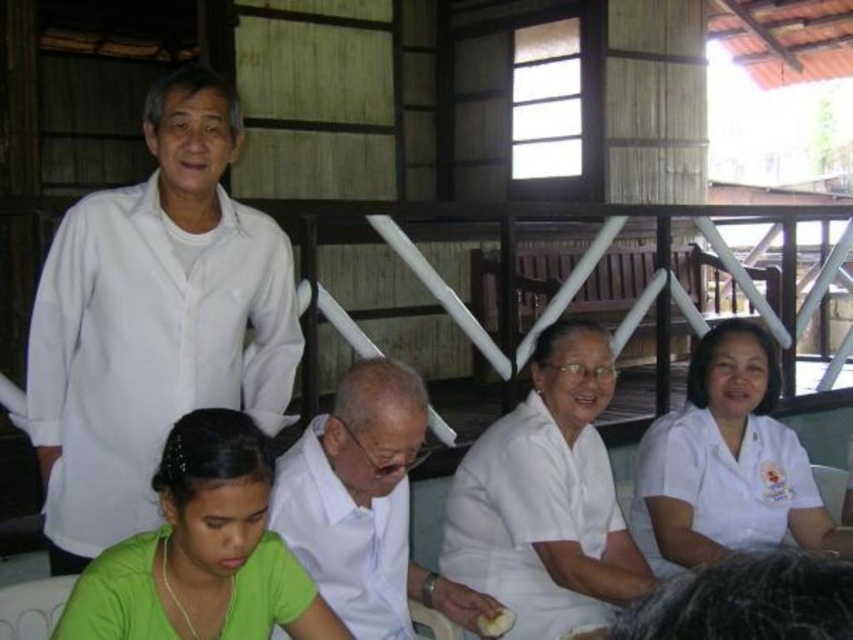
You are a photographer trying to capture a clear shot of the white matte shirt at upper left and the white smooth uniform at lower right. Which of the two is positioned higher in the image?

The white matte shirt at upper left is located above the white smooth uniform at lower right, so it is positioned higher in the image.

You are a photographer trying to capture a group photo of the white matte shirt at upper left and the white smooth uniform at lower right. Which one is located more to the left side of the image?

The white matte shirt at upper left is more to the left side of the image.

Consider the image. You are standing at the point marked as point (399, 493) and want to greet the group of five individuals. Considering the distance between you and them is 6.72 feet, can you comfortably walk towards them without needing to adjust your path?

The distance between you and the group is 6.72 feet, so yes, you can comfortably walk towards them without needing to adjust your path as the distance is manageable for a direct approach.